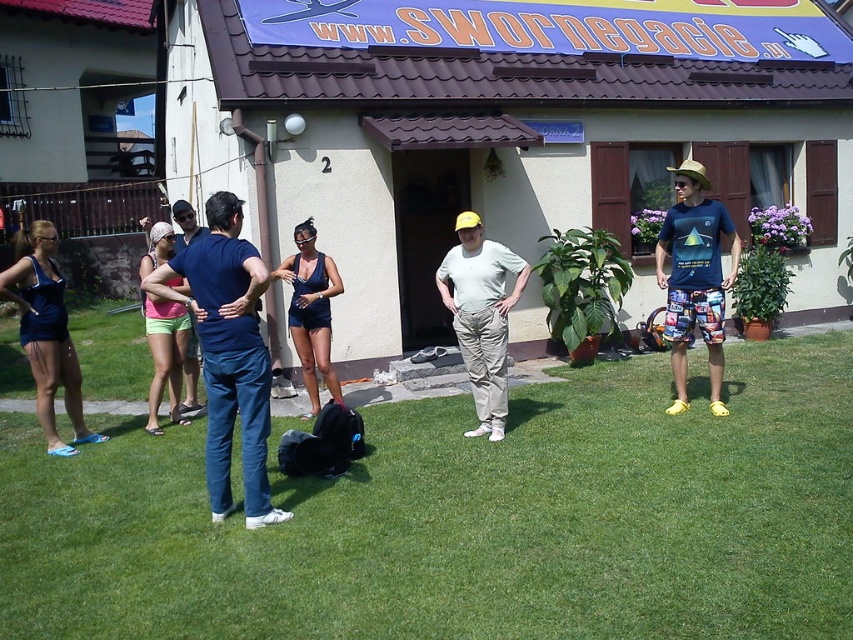
Is green grass at center shorter than matte blue swimsuit at left?

Correct, green grass at center is not as tall as matte blue swimsuit at left.

At what (x,y) coordinates should I click in order to perform the action: click on green grass at center. Please return your answer as a coordinate pair (x, y). Looking at the image, I should click on (469, 518).

Which is behind, point (12, 493) or point (265, 520)?

Positioned behind is point (12, 493).

Can you confirm if green grass at center is thinner than dark blue jeans at center?

No, green grass at center is not thinner than dark blue jeans at center.

The image size is (853, 640). Find the location of `green grass at center`. green grass at center is located at coordinates (469, 518).

Can you confirm if blue denim shorts at right is smaller than matte blue shirt at center?

No.

Between point (686, 212) and point (196, 333), which one is positioned behind?

Positioned behind is point (196, 333).

Find the location of a particular element. This screenshot has width=853, height=640. blue denim shorts at right is located at coordinates (694, 280).